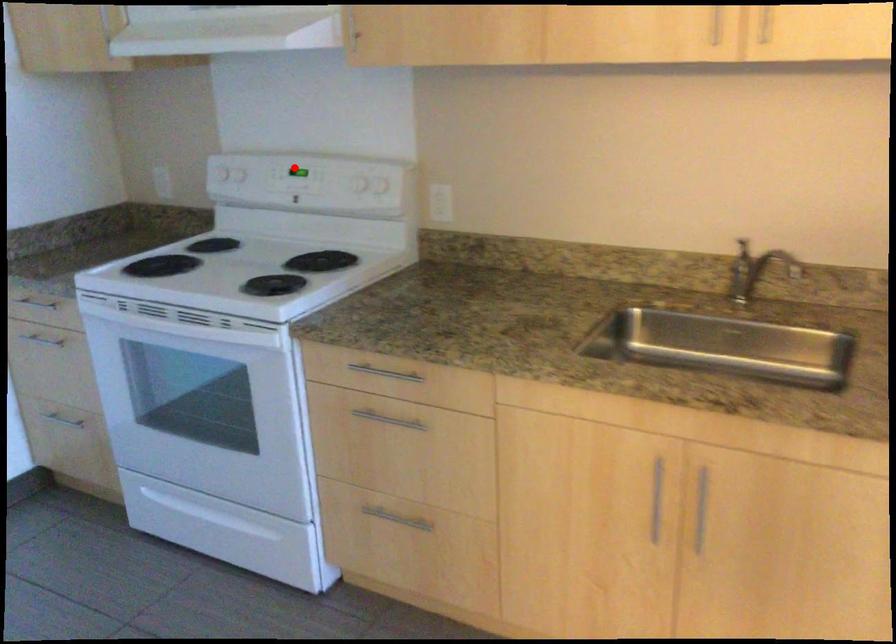
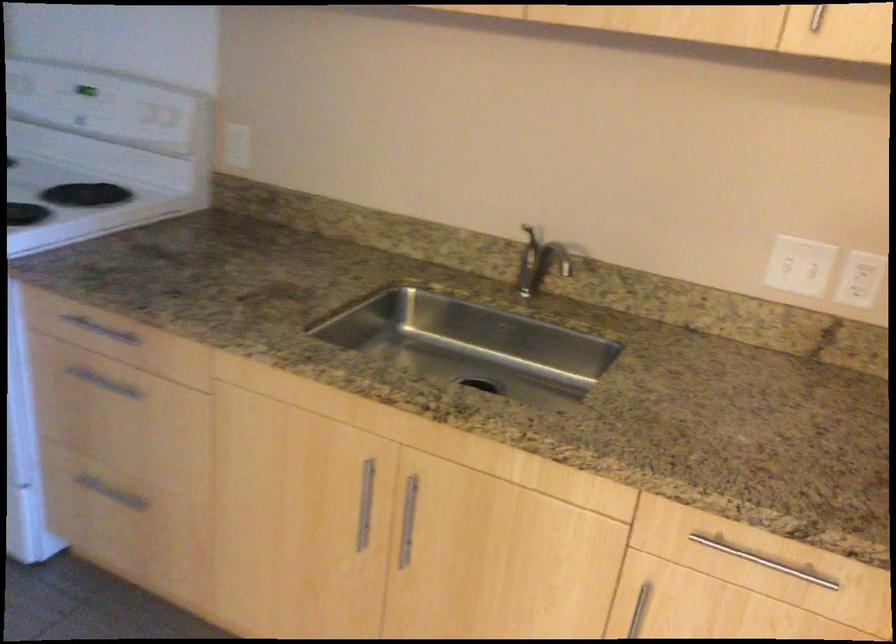
Question: I am providing you with two images of the same scene from different viewpoints. Given a red point in image1, look at the same physical point in image2. Is it:

Choices:
 (A) Closer to the viewpoint
 (B) Farther from the viewpoint

Answer: (A)